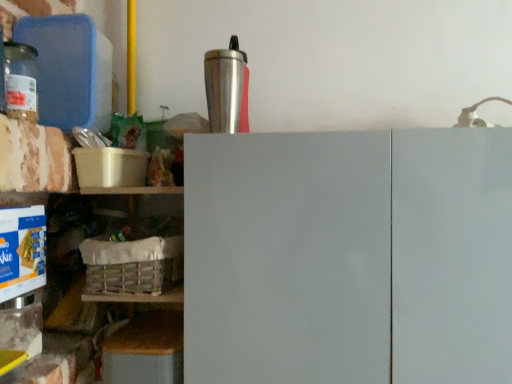
Question: Is the depth of silver metallic tumbler at upper center less than that of wooden crate at lower left?

Choices:
 (A) yes
 (B) no

Answer: (A)

Question: Can you confirm if silver metallic tumbler at upper center is wider than wooden crate at lower left?

Choices:
 (A) yes
 (B) no

Answer: (B)

Question: Is silver metallic tumbler at upper center oriented away from wooden crate at lower left?

Choices:
 (A) yes
 (B) no

Answer: (B)

Question: From a real-world perspective, is silver metallic tumbler at upper center beneath wooden crate at lower left?

Choices:
 (A) yes
 (B) no

Answer: (B)

Question: Does silver metallic tumbler at upper center appear on the right side of wooden crate at lower left?

Choices:
 (A) yes
 (B) no

Answer: (A)

Question: Would you say wooden crate at lower left is part of silver metallic tumbler at upper center's contents?

Choices:
 (A) no
 (B) yes

Answer: (A)

Question: Is white woven basket at lower left to the left of translucent glass jar at left from the viewer's perspective?

Choices:
 (A) no
 (B) yes

Answer: (A)

Question: From the image's perspective, would you say white woven basket at lower left is shown under translucent glass jar at left?

Choices:
 (A) no
 (B) yes

Answer: (B)

Question: Does white woven basket at lower left appear on the right side of translucent glass jar at left?

Choices:
 (A) yes
 (B) no

Answer: (A)

Question: From a real-world perspective, is white woven basket at lower left positioned under translucent glass jar at left based on gravity?

Choices:
 (A) yes
 (B) no

Answer: (A)

Question: Does white woven basket at lower left contain translucent glass jar at left?

Choices:
 (A) yes
 (B) no

Answer: (B)

Question: Is white woven basket at lower left aimed at translucent glass jar at left?

Choices:
 (A) no
 (B) yes

Answer: (A)

Question: Is silver metallic tumbler at upper center outside of translucent glass jar at left?

Choices:
 (A) no
 (B) yes

Answer: (B)